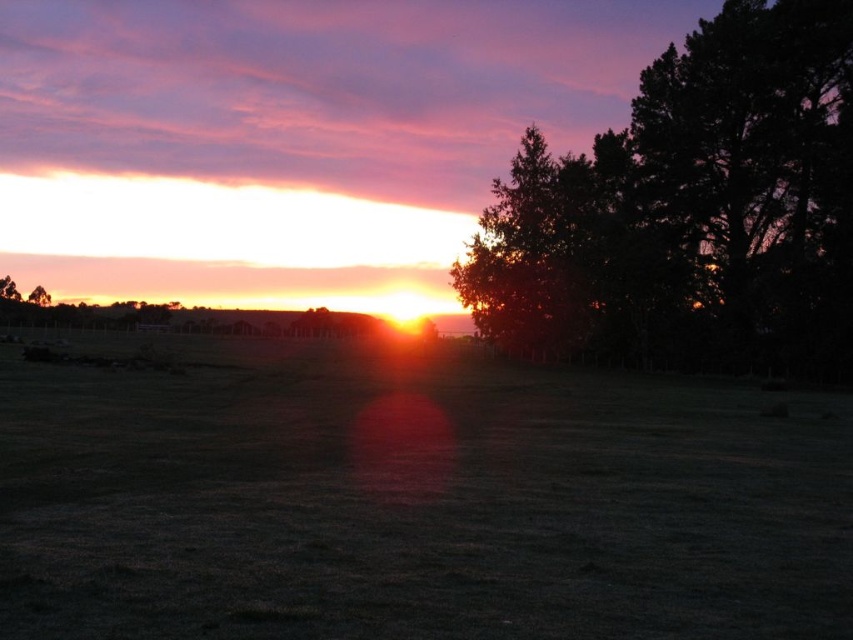
Question: Which of the following is the farthest from the observer?

Choices:
 (A) (27, 300)
 (B) (148, 509)
 (C) (16, 289)

Answer: (C)

Question: Is brown grassy field at center thinner than dark green leafy tree at right?

Choices:
 (A) no
 (B) yes

Answer: (A)

Question: Estimate the real-world distances between objects in this image. Which object is closer to the dark green leafy tree at right?

Choices:
 (A) green matte tree at left
 (B) green leafy tree at left

Answer: (A)

Question: Is green leafy tree at left below green matte tree at left?

Choices:
 (A) yes
 (B) no

Answer: (B)

Question: Does brown grassy field at center appear over dark green leafy tree at right?

Choices:
 (A) no
 (B) yes

Answer: (A)

Question: Based on their relative distances, which object is nearer to the brown grassy field at center?

Choices:
 (A) dark green leafy tree at right
 (B) green leafy tree at left
 (C) green matte tree at left

Answer: (A)